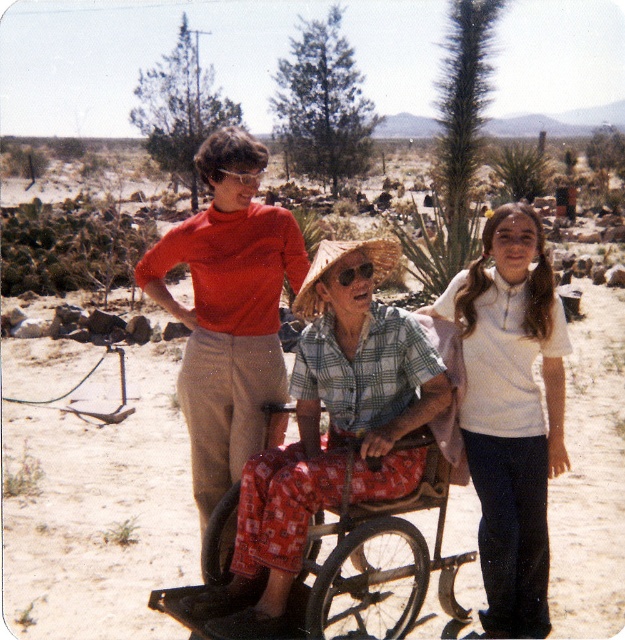
From the picture: Does white cotton shirt at center have a greater height compared to plaid fabric wheelchair at center?

Correct, white cotton shirt at center is much taller as plaid fabric wheelchair at center.

Who is lower down, white cotton shirt at center or plaid fabric wheelchair at center?

white cotton shirt at center is below.

Who is more forward, (x=551, y=420) or (x=228, y=525)?

Positioned in front is point (x=228, y=525).

Locate an element on the screen. white cotton shirt at center is located at coordinates (511, 412).

Is point (366, 316) positioned behind point (262, 314)?

No, it is in front of (262, 314).

I want to click on plaid cotton shirt at center, so click(x=331, y=433).

Identify the location of plaid cotton shirt at center. 331,433.

Who is more forward, (356, 381) or (338, 268)?

Point (338, 268) is more forward.

Does plaid cotton shirt at center have a greater width compared to clear plastic goggles at center?

Correct, the width of plaid cotton shirt at center exceeds that of clear plastic goggles at center.

Between point (352, 371) and point (325, 280), which one is positioned behind?

The point (352, 371) is more distant.

Locate an element on the screen. The height and width of the screenshot is (640, 625). plaid cotton shirt at center is located at coordinates (331, 433).